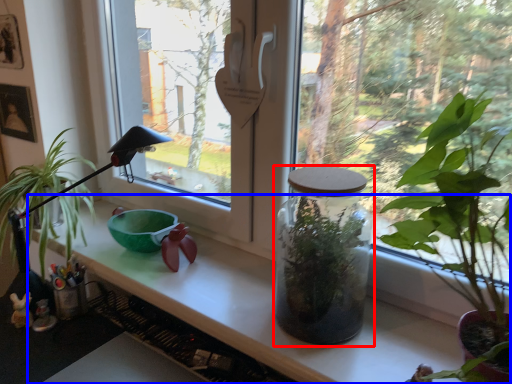
Question: Which of the following is the farthest to the observer, glass jar (highlighted by a red box) or counter top (highlighted by a blue box)?

Choices:
 (A) glass jar
 (B) counter top

Answer: (A)